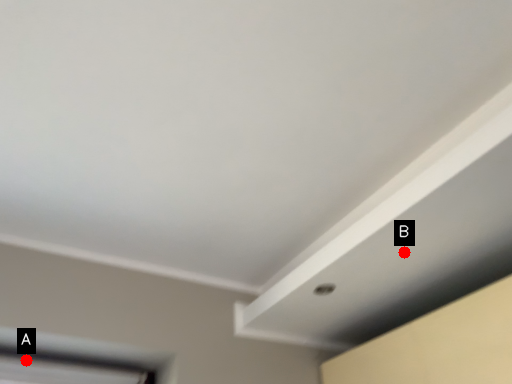
Question: Two points are circled on the image, labeled by A and B beside each circle. Which point appears closest to the camera in this image?

Choices:
 (A) A is closer
 (B) B is closer

Answer: (B)